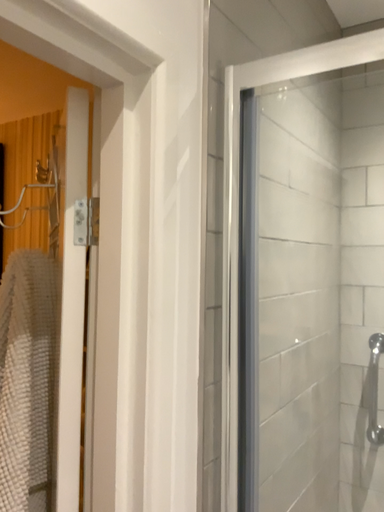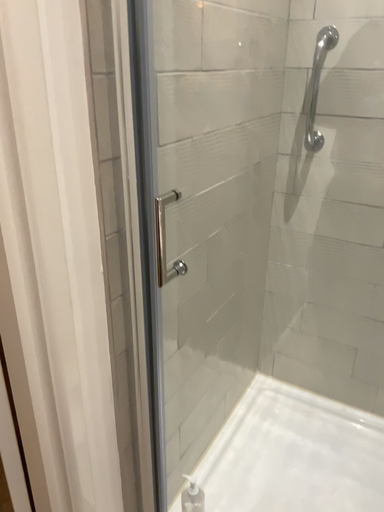
Question: Which way did the camera rotate in the video?

Choices:
 (A) rotated downward
 (B) rotated upward

Answer: (A)